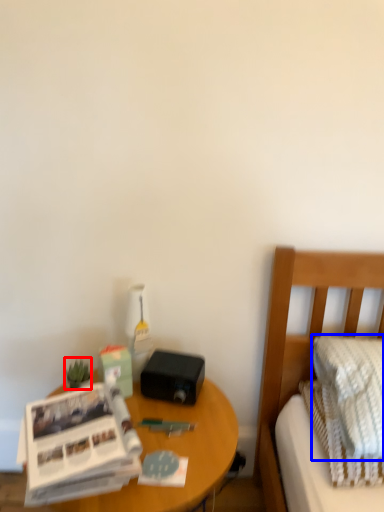
Question: Which of the following is the farthest to the observer, plant (highlighted by a red box) or pillow (highlighted by a blue box)?

Choices:
 (A) plant
 (B) pillow

Answer: (A)